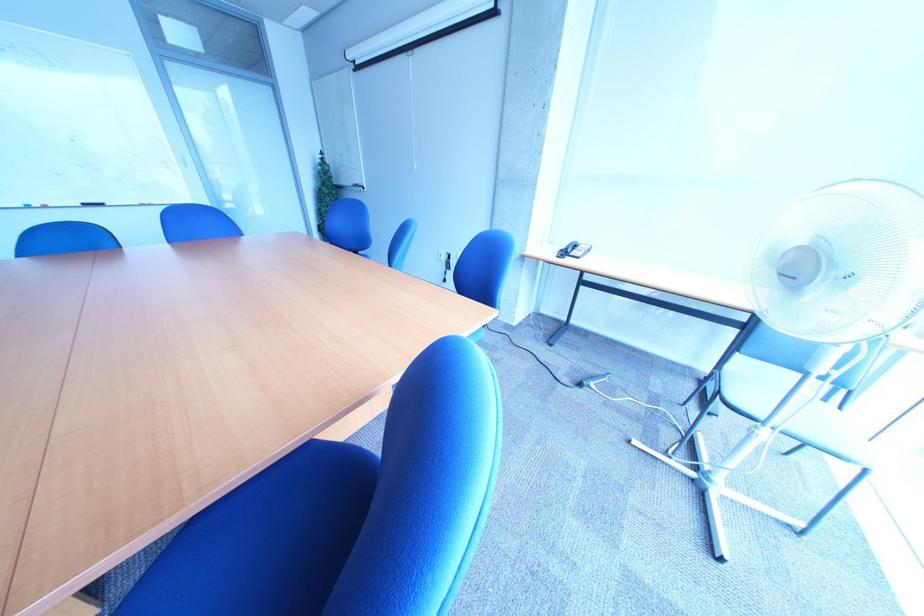
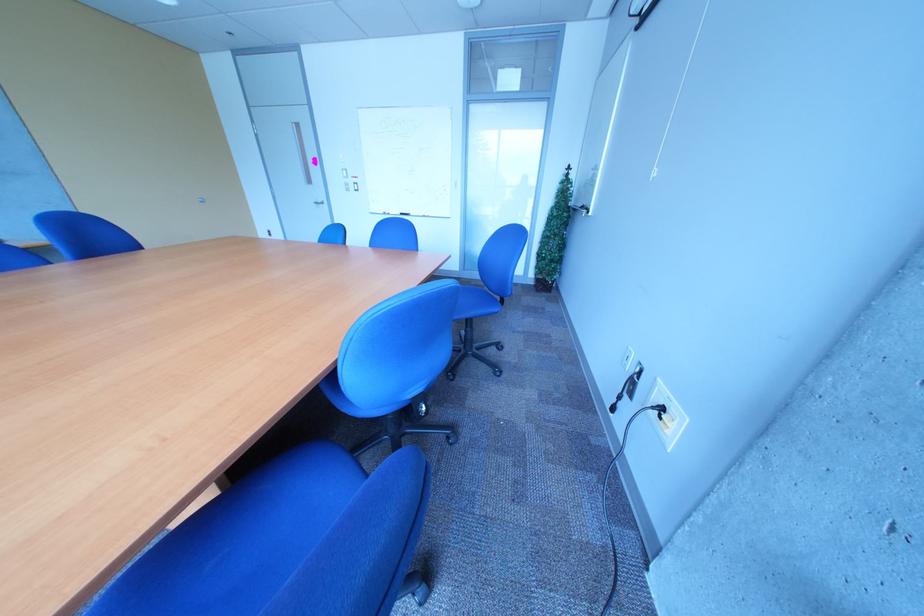
Where in the second image is the point corresponding to (x=62, y=208) from the first image?

(405, 216)